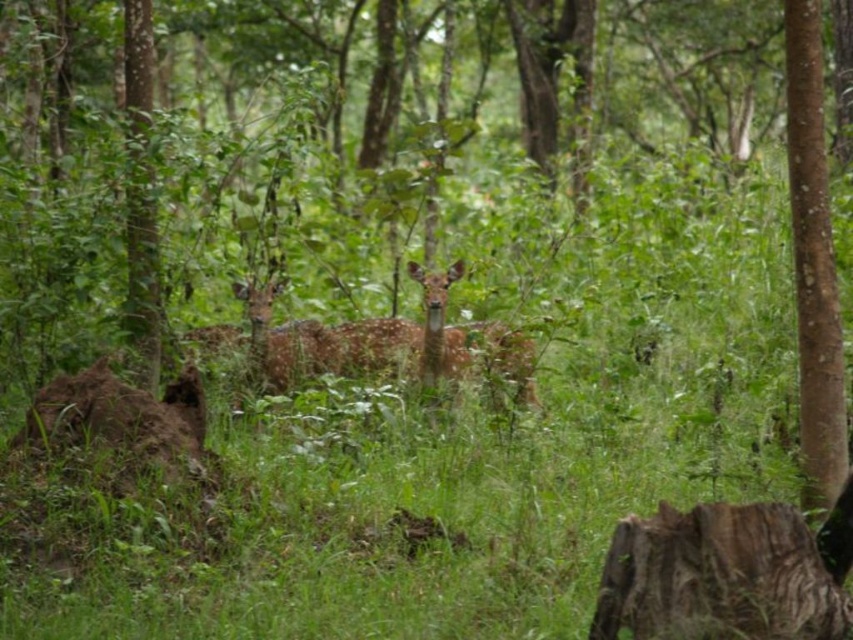
You are a photographer trying to capture a closeup shot of the deer in the forest. You have two points marked in the scene, point (808, 193) and point (527, 394). Which point should you focus on to get a clearer image of the deer?

Point (808, 193) is closer to the camera than point (527, 394), so focusing on point (808, 193) will provide a clearer image of the deer.

You are a hiker in the forest and want to take a photo of the spotted fur deer at center without the brown smooth tree trunk at right blocking the view. Is there a way to position yourself so that the deer is visible and the tree trunk is not in the frame?

The brown smooth tree trunk at right is above the spotted fur deer at center, so if you position yourself lower or move to the left side, you can capture the deer without the tree trunk blocking the view.

You are a hiker in the forest and see both the brown smooth tree trunk at right and the spotted fur deer at center. Which object is located to the right of the other?

The brown smooth tree trunk at right is located to the right of the spotted fur deer at center.